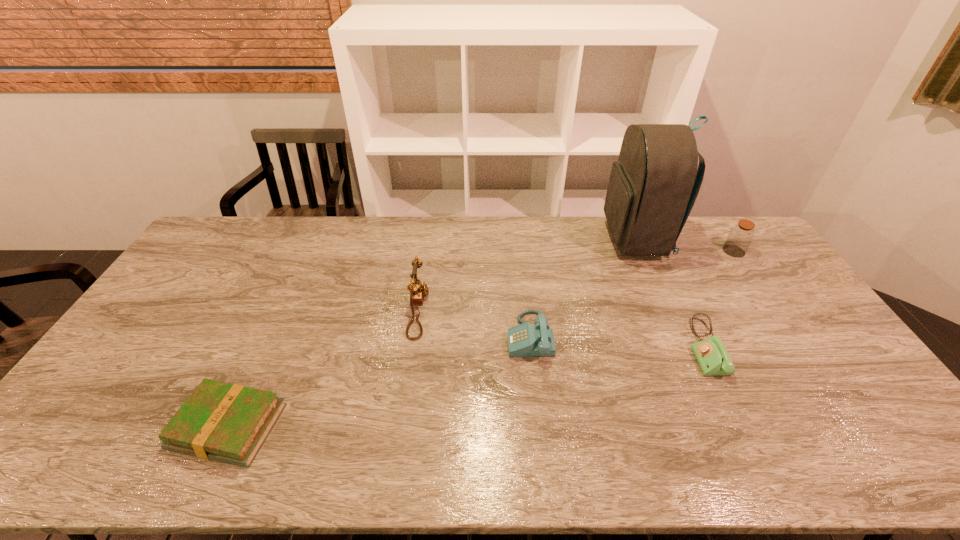
Where is `object that is the second nearest to the jar`? This screenshot has height=540, width=960. object that is the second nearest to the jar is located at coordinates (713, 358).

Identify which telephone is the second nearest to the shortest telephone. Please provide its 2D coordinates. Your answer should be formatted as a tuple, i.e. [(x, y)], where the tuple contains the x and y coordinates of a point satisfying the conditions above.

[(418, 289)]

At what (x,y) coordinates should I click in order to perform the action: click on telephone that stands as the third closest to the rightmost object. Please return your answer as a coordinate pair (x, y). Looking at the image, I should click on (418, 289).

Where is `vacant area that satisfies the following two spatial constraints: 1. on the dial of the shortest telephone; 2. on the front side of the nearest object`? This screenshot has width=960, height=540. vacant area that satisfies the following two spatial constraints: 1. on the dial of the shortest telephone; 2. on the front side of the nearest object is located at coordinates (743, 427).

You are a GUI agent. You are given a task and a screenshot of the screen. Output one action in this format:
    pyautogui.click(x=<x>, y=<y>)
    Task: Click on the free spot that satisfies the following two spatial constraints: 1. on the front-facing side of the backpack; 2. on the left side of the rightmost object
    This screenshot has height=540, width=960.
    Given the screenshot: What is the action you would take?
    pyautogui.click(x=641, y=251)